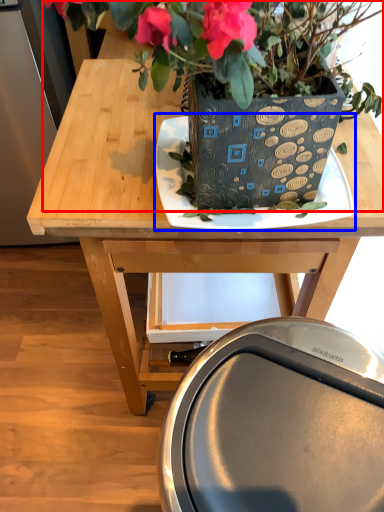
Question: Which object is closer to the camera taking this photo, houseplant (highlighted by a red box) or plate (highlighted by a blue box)?

Choices:
 (A) houseplant
 (B) plate

Answer: (A)